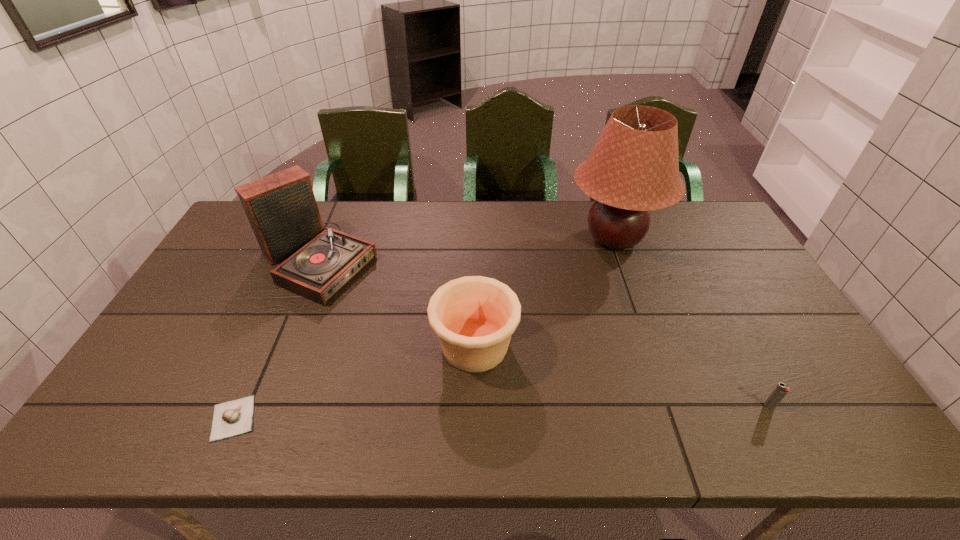
Find the location of a particular element. This screenshot has height=540, width=960. unoccupied area between the tallest object and the garlic is located at coordinates click(423, 328).

Where is `vacant point located between the rightmost object and the third object from right to left`? The image size is (960, 540). vacant point located between the rightmost object and the third object from right to left is located at coordinates (622, 376).

This screenshot has width=960, height=540. Find the location of `free space between the tallest object and the fourth shortest object`. free space between the tallest object and the fourth shortest object is located at coordinates (466, 249).

Where is `vacant space in between the third object from left to right and the lampshade`? This screenshot has height=540, width=960. vacant space in between the third object from left to right and the lampshade is located at coordinates (544, 292).

Identify the location of vacant area that lies between the third farthest object and the garlic. The width and height of the screenshot is (960, 540). (354, 382).

I want to click on free area in between the fourth tallest object and the garlic, so click(x=501, y=412).

Locate an element on the screen. free space between the third object from right to left and the lampshade is located at coordinates (544, 292).

Where is `vacant point located between the tallest object and the third tallest object`? Image resolution: width=960 pixels, height=540 pixels. vacant point located between the tallest object and the third tallest object is located at coordinates (544, 292).

What are the coordinates of `empty space between the igniter and the shortest object` in the screenshot? It's located at (501, 412).

I want to click on object that is the nearest to the garlic, so click(281, 208).